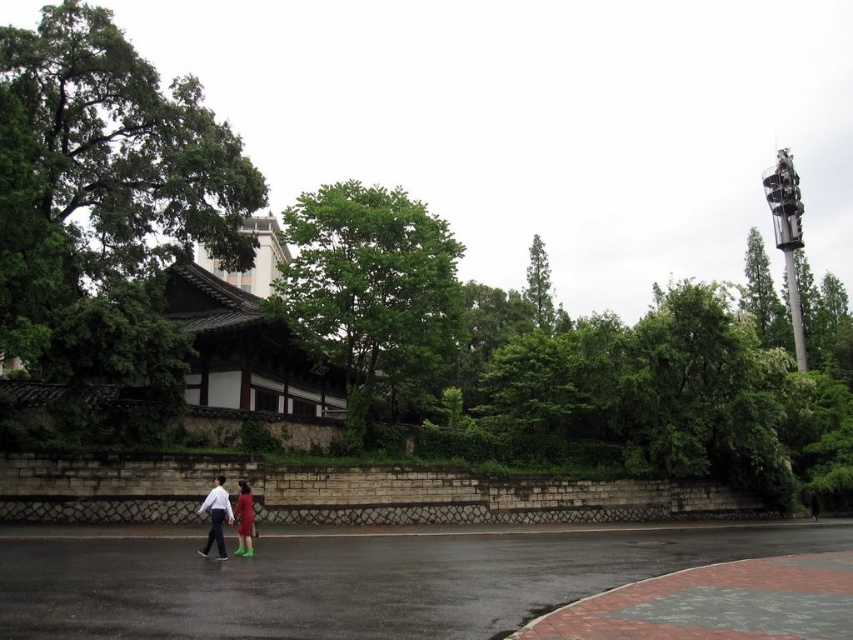
Does green leafy tree at center appear on the left side of green leafy tree at upper center?

Correct, you'll find green leafy tree at center to the left of green leafy tree at upper center.

What do you see at coordinates (370, 289) in the screenshot? I see `green leafy tree at center` at bounding box center [370, 289].

Which is behind, point (323, 234) or point (534, 314)?

Point (534, 314)

Locate an element on the screen. The height and width of the screenshot is (640, 853). green leafy tree at center is located at coordinates (370, 289).

Can you confirm if green leafy tree at upper center is shorter than matte green boots at lower center?

No.

Find the location of a particular element. This screenshot has width=853, height=640. green leafy tree at upper center is located at coordinates pos(538,285).

In order to click on green leafy tree at upper center in this screenshot , I will do `click(538, 285)`.

Is green leafy tree at upper left to the left of matte green boots at lower center from the viewer's perspective?

Yes, green leafy tree at upper left is to the left of matte green boots at lower center.

Who is more forward, (93, 124) or (242, 513)?

Point (242, 513) is more forward.

Is point (123, 92) positioned before point (245, 499)?

That is False.

This screenshot has height=640, width=853. I want to click on green leafy tree at upper left, so click(105, 196).